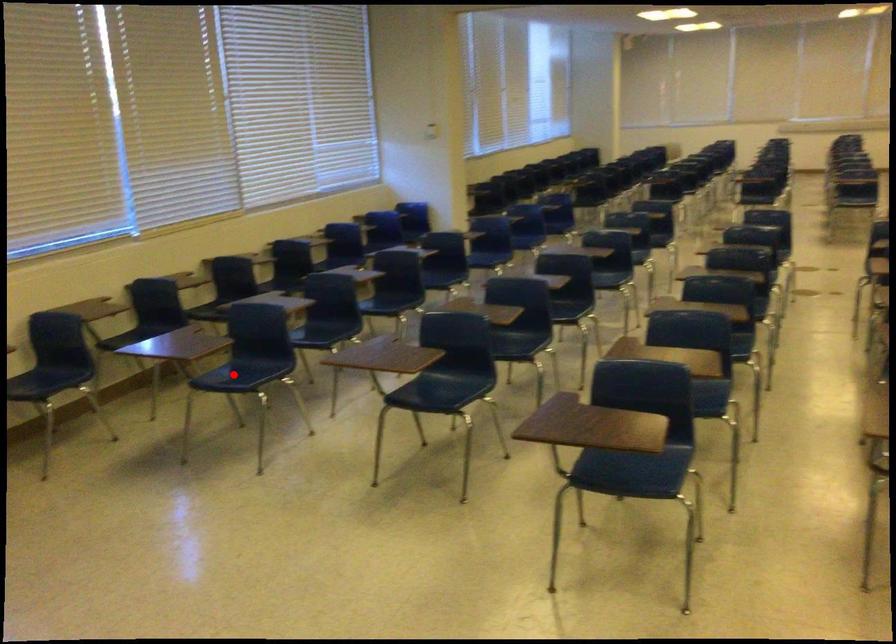
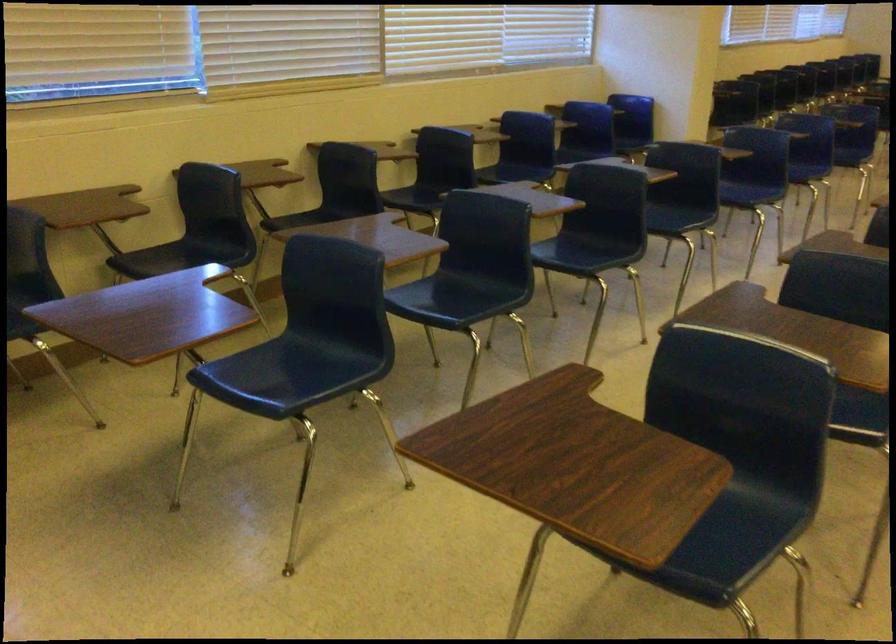
The point at the highlighted location is marked in the first image. Where is the corresponding point in the second image?

(283, 375)